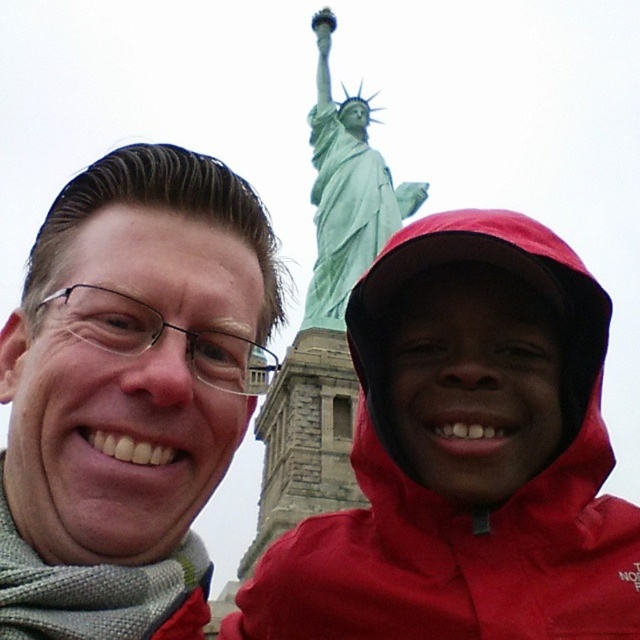
Consider the image. Does red waterproof jacket at center appear on the left side of green patina statue at upper center?

Yes, red waterproof jacket at center is to the left of green patina statue at upper center.

Who is more distant from viewer, (353, 554) or (376, 164)?

Positioned behind is point (376, 164).

Does point (284, 572) lie in front of point (321, 13)?

Yes, point (284, 572) is closer to viewer.

Find the location of `red waterproof jacket at center`. red waterproof jacket at center is located at coordinates (456, 502).

Between matte black glasses at left and green patina statue at upper center, which one has less height?

→ With less height is matte black glasses at left.

Is matte black glasses at left further to camera compared to green patina statue at upper center?

No.

Is point (77, 573) less distant than point (328, 49)?

Yes, it is.

You are a GUI agent. You are given a task and a screenshot of the screen. Output one action in this format:
    pyautogui.click(x=<x>, y=<y>)
    Task: Click on the matte black glasses at left
    The image size is (640, 640).
    Given the screenshot: What is the action you would take?
    pyautogui.click(x=129, y=388)

Can you confirm if matte black glasses at left is smaller than red waterproof jacket at center?

Actually, matte black glasses at left might be larger than red waterproof jacket at center.

Locate an element on the screen. The width and height of the screenshot is (640, 640). matte black glasses at left is located at coordinates (129, 388).

Measure the distance between point [28,540] and camera.

A distance of 52.96 meters exists between point [28,540] and camera.

The image size is (640, 640). Find the location of `matte black glasses at left`. matte black glasses at left is located at coordinates (129, 388).